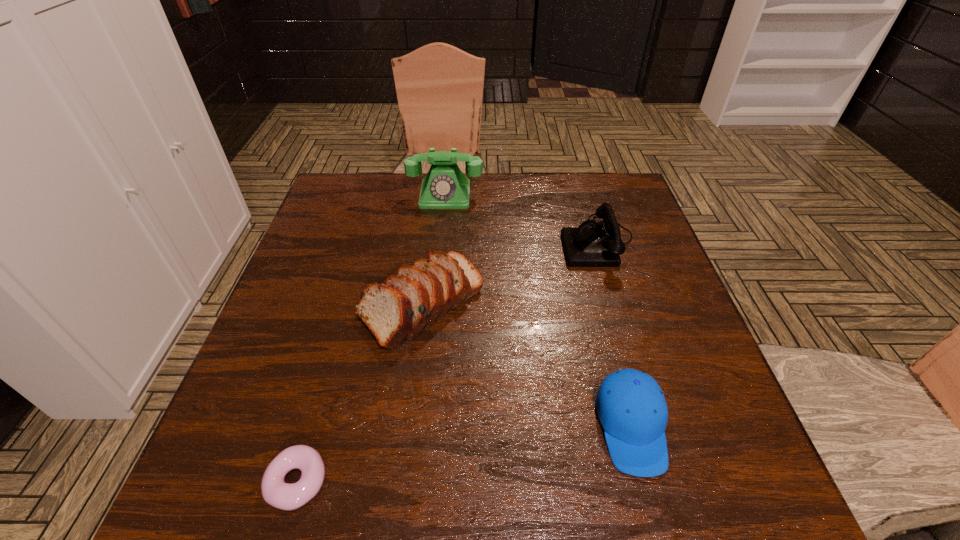
You are a GUI agent. You are given a task and a screenshot of the screen. Output one action in this format:
    pyautogui.click(x=<x>, y=<y>)
    Task: Click on the object located in the near right corner section of the desktop
    The width and height of the screenshot is (960, 540).
    Given the screenshot: What is the action you would take?
    pyautogui.click(x=630, y=405)

You are a GUI agent. You are given a task and a screenshot of the screen. Output one action in this format:
    pyautogui.click(x=<x>, y=<y>)
    Task: Click on the vacant space at the far edge
    This screenshot has height=540, width=960.
    Given the screenshot: What is the action you would take?
    pyautogui.click(x=400, y=200)

Locate an element on the screen. The height and width of the screenshot is (540, 960). vacant space at the near edge of the desktop is located at coordinates (445, 502).

The width and height of the screenshot is (960, 540). Find the location of `vacant position at the left edge of the desktop`. vacant position at the left edge of the desktop is located at coordinates (359, 268).

In order to click on vacant region at the right edge of the desktop in this screenshot , I will do `click(674, 359)`.

Identify the location of vacant region at the far left corner of the desktop. (362, 206).

Identify the location of free space that is in between the cap and the doughnut. (464, 454).

Find the location of a particular element. free space between the farthest object and the shortest object is located at coordinates (372, 338).

Where is `free point between the farther telephone and the bread`? This screenshot has width=960, height=540. free point between the farther telephone and the bread is located at coordinates [x=433, y=248].

I want to click on vacant area that lies between the taller telephone and the bread, so click(433, 248).